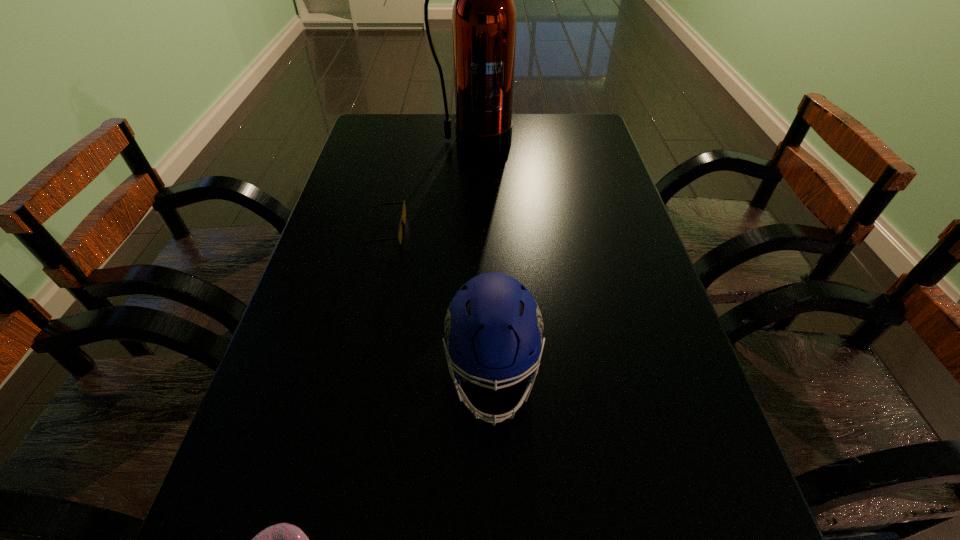
This screenshot has height=540, width=960. I want to click on object that is at the left edge, so click(399, 237).

At what (x,y) coordinates should I click in order to perform the action: click on free space at the far edge. Please return your answer as a coordinate pair (x, y). Looking at the image, I should click on (527, 143).

In the image, there is a desktop. Where is `vacant area at the left edge`? The height and width of the screenshot is (540, 960). vacant area at the left edge is located at coordinates (403, 168).

In the image, there is a desktop. Identify the location of vacant region at the right edge. The image size is (960, 540). (650, 402).

The width and height of the screenshot is (960, 540). In the image, there is a desktop. In order to click on free space at the far left corner in this screenshot , I will do `click(386, 122)`.

Where is `vacant space at the far right corner of the desktop`? The image size is (960, 540). vacant space at the far right corner of the desktop is located at coordinates (569, 117).

This screenshot has height=540, width=960. What are the coordinates of `vacant space that's between the second tallest object and the tallest object` in the screenshot? It's located at (483, 258).

This screenshot has width=960, height=540. In order to click on vacant point located between the third tallest object and the third shortest object in this screenshot , I will do `click(440, 303)`.

This screenshot has height=540, width=960. I want to click on free space between the third tallest object and the tallest object, so click(x=430, y=187).

Find the location of a particular element. The height and width of the screenshot is (540, 960). empty space that is in between the tallest object and the second nearest object is located at coordinates [483, 258].